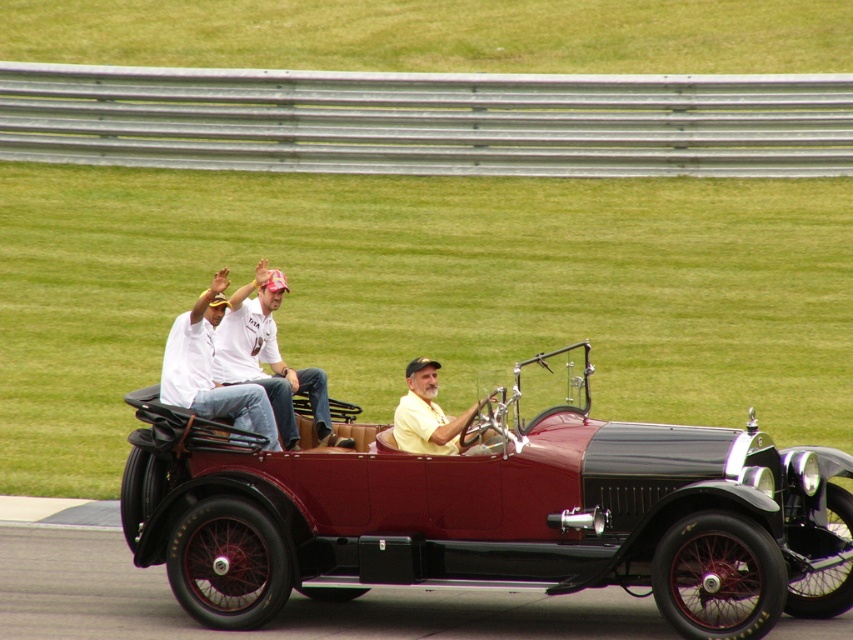
Question: Is maroon leather convertible at center further to the viewer compared to yellow matte shirt at center?

Choices:
 (A) yes
 (B) no

Answer: (B)

Question: Estimate the real-world distances between objects in this image. Which object is closer to the maroon leather convertible at center?

Choices:
 (A) yellow matte shirt at center
 (B) white cotton shirt at center
 (C) white cotton shirt at upper center

Answer: (A)

Question: Among these objects, which one is farthest from the camera?

Choices:
 (A) maroon leather convertible at center
 (B) white cotton shirt at center

Answer: (B)

Question: In this image, where is maroon leather convertible at center located relative to white cotton shirt at upper center?

Choices:
 (A) right
 (B) left

Answer: (A)

Question: Is maroon leather convertible at center below yellow matte shirt at center?

Choices:
 (A) yes
 (B) no

Answer: (A)

Question: Which object is closer to the camera taking this photo?

Choices:
 (A) maroon leather convertible at center
 (B) white cotton shirt at upper center
 (C) white cotton shirt at center

Answer: (A)